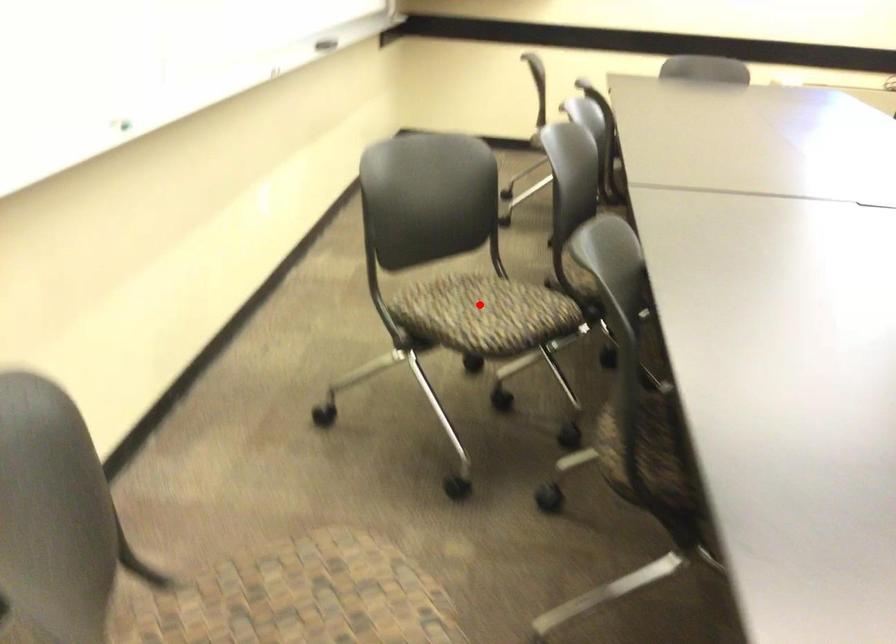
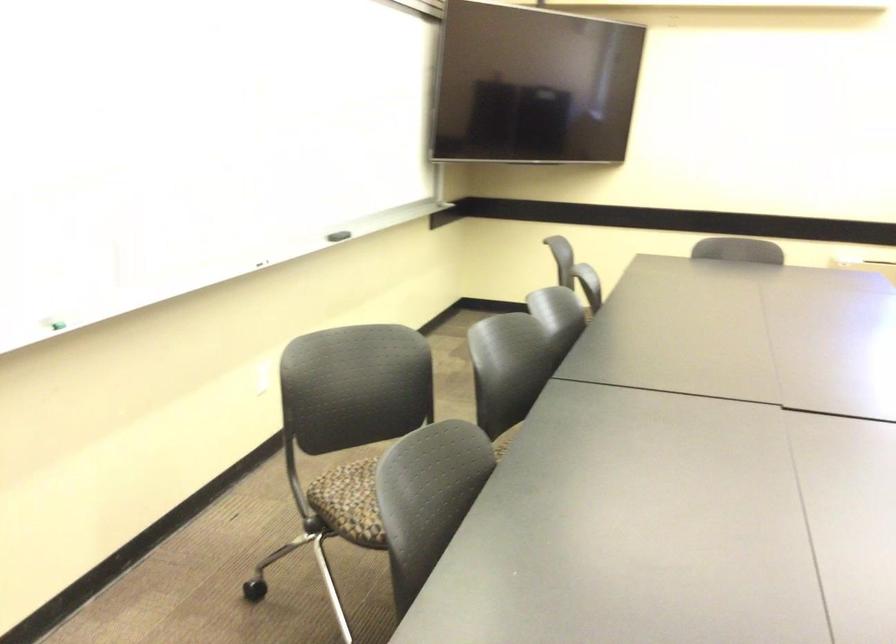
Question: I am providing you with two images of the same scene from different viewpoints. A red point is marked on the first image. At the location where the point appears in image 1, is it still visible in image 2?

Choices:
 (A) Yes
 (B) No

Answer: (B)